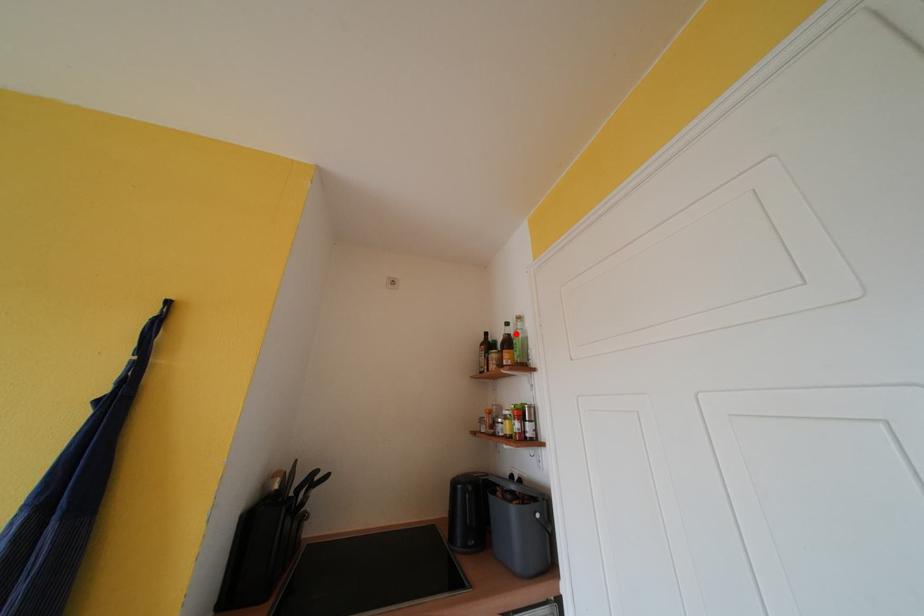
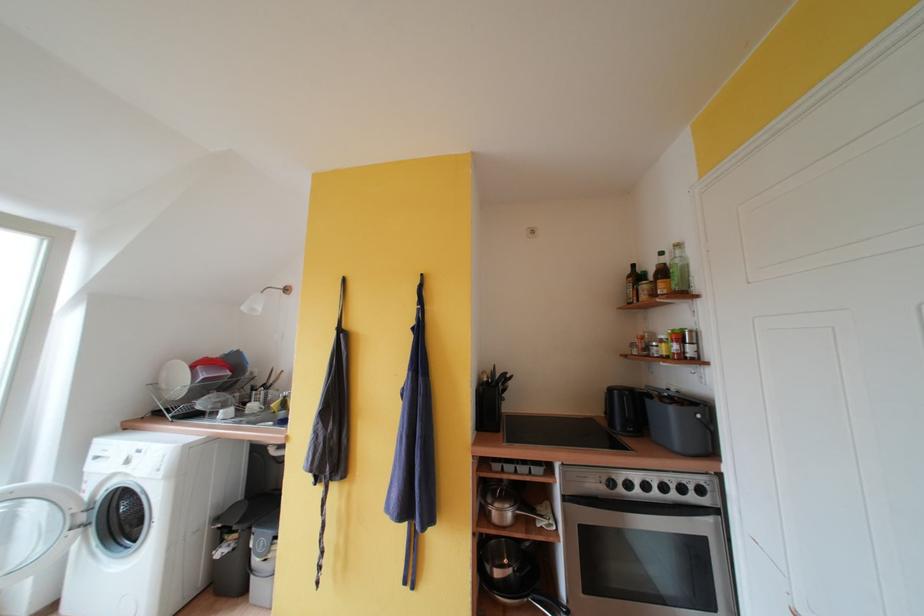
Where in the second image is the point corresponding to the highlighted location from the first image?

(671, 262)